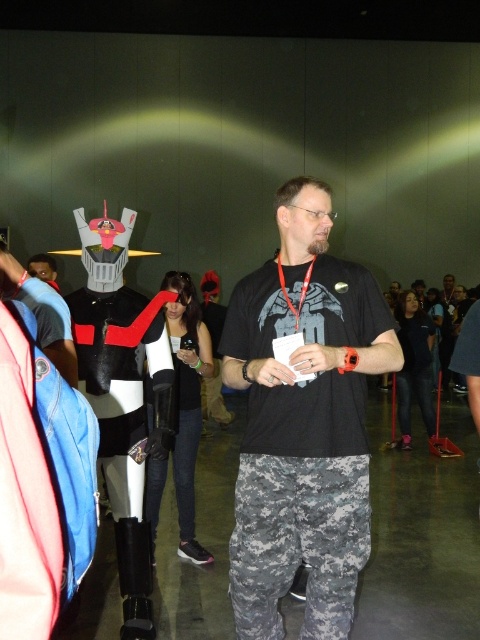
Question: Which of the following is the closest to the observer?

Choices:
 (A) black matte t-shirt at center
 (B) matte black neck at center
 (C) digital camo pants at center
 (D) red fabric lanyard at center

Answer: (A)

Question: Does black matte t-shirt at center appear on the right side of digital camo pants at center?

Choices:
 (A) no
 (B) yes

Answer: (B)

Question: Based on their relative distances, which object is farther from the matte black neck at center?

Choices:
 (A) digital camo pants at center
 (B) red fabric lanyard at center
 (C) black matte t-shirt at center

Answer: (A)

Question: Which object is closer to the camera taking this photo?

Choices:
 (A) black matte t-shirt at center
 (B) matte black neck at center
 (C) digital camo pants at center
 (D) red fabric lanyard at center

Answer: (A)

Question: Is black matte t-shirt at center wider than red fabric lanyard at center?

Choices:
 (A) yes
 (B) no

Answer: (A)

Question: Can you confirm if black matte t-shirt at center is thinner than matte black neck at center?

Choices:
 (A) yes
 (B) no

Answer: (B)